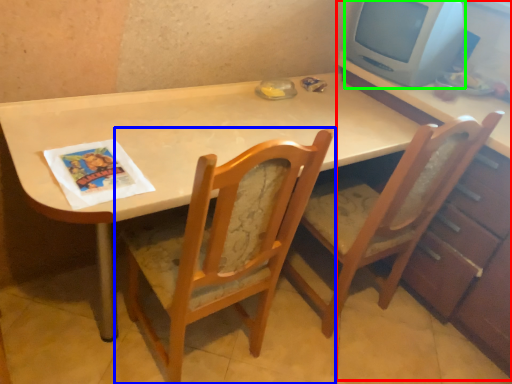
Question: Based on their relative distances, which object is farther from dresser (highlighted by a red box)? Choose from chair (highlighted by a blue box) and computer monitor (highlighted by a green box).

Choices:
 (A) chair
 (B) computer monitor

Answer: (A)